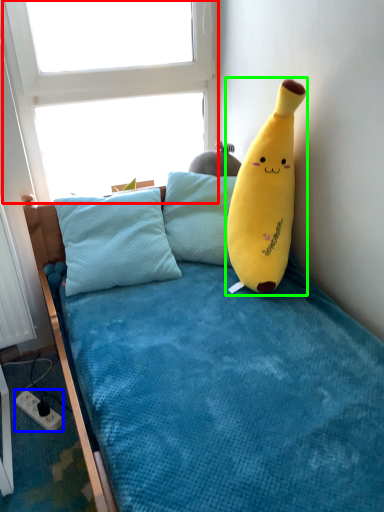
Question: Which object is positioned farthest from window screen (highlighted by a red box)? Select from power outlet (highlighted by a blue box) and toy (highlighted by a green box).

Choices:
 (A) power outlet
 (B) toy

Answer: (A)